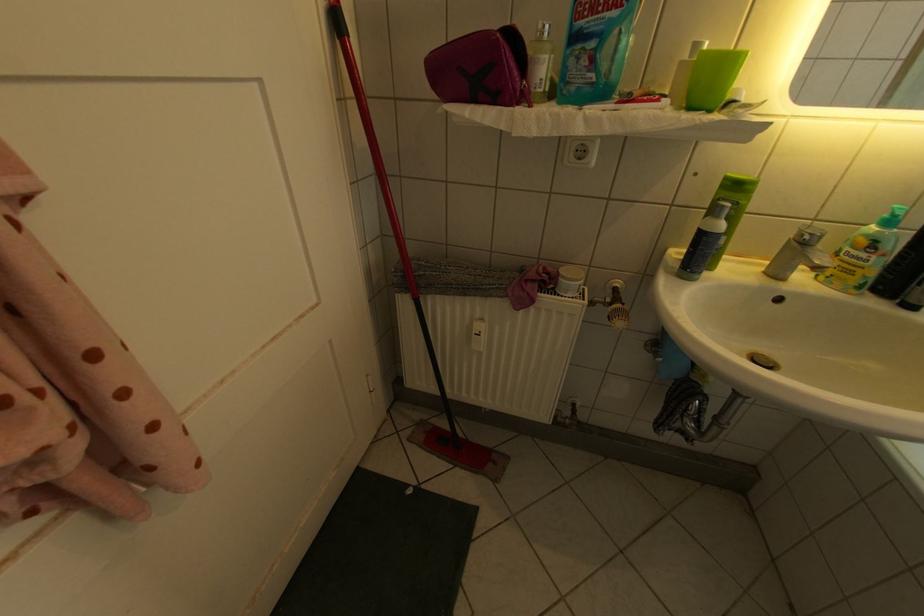
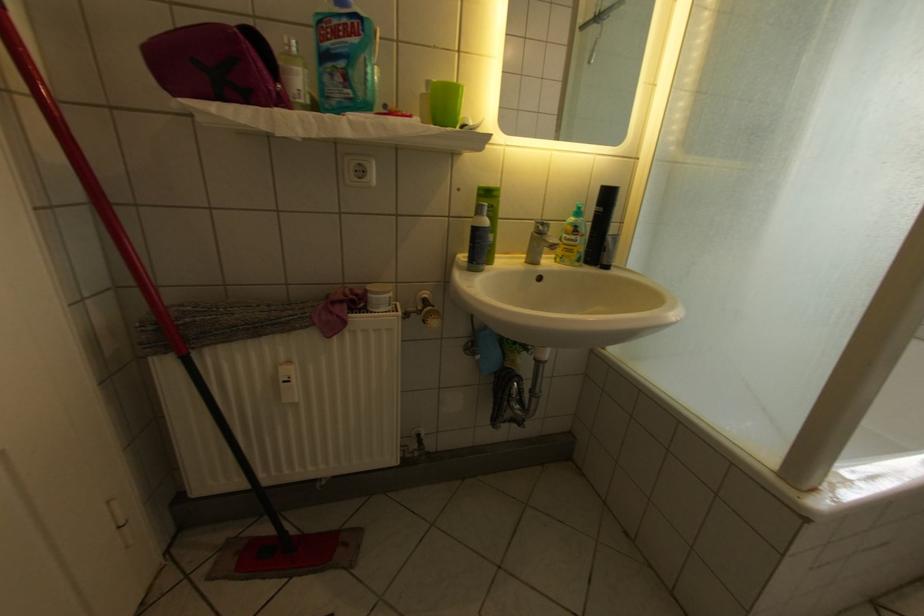
Find the pixel in the second image that matches point (621, 301) in the first image.

(432, 309)